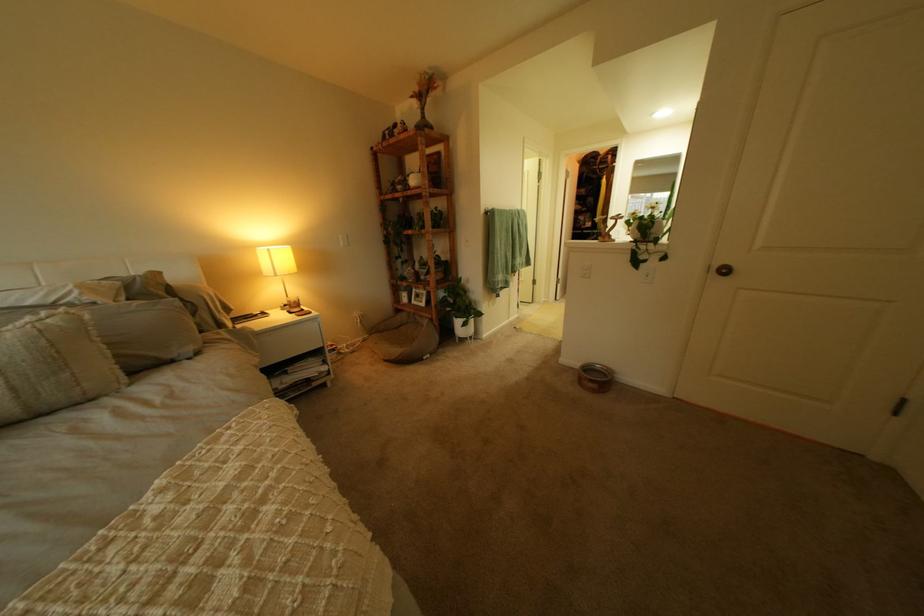
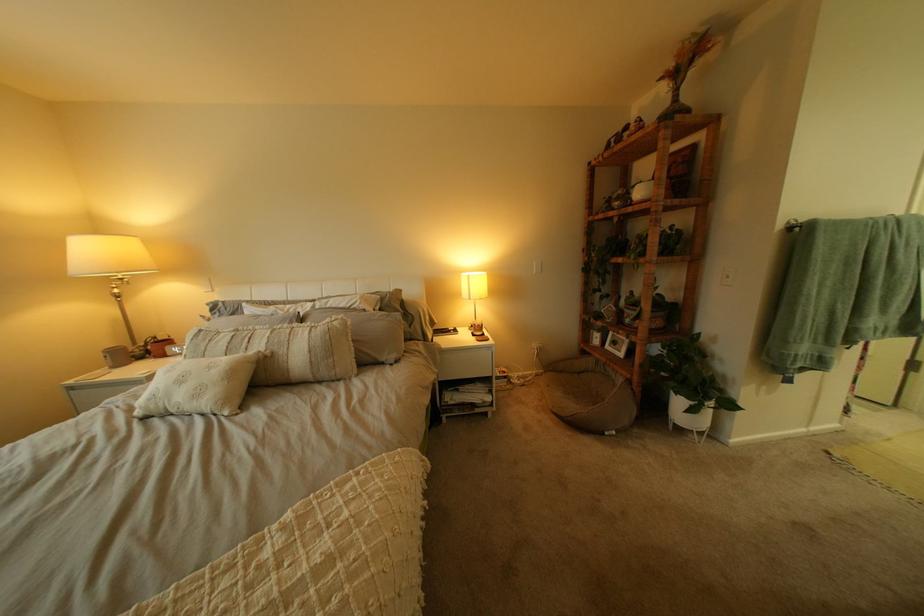
Find the pixel in the second image that matches point 429,302 in the first image.

(623, 347)